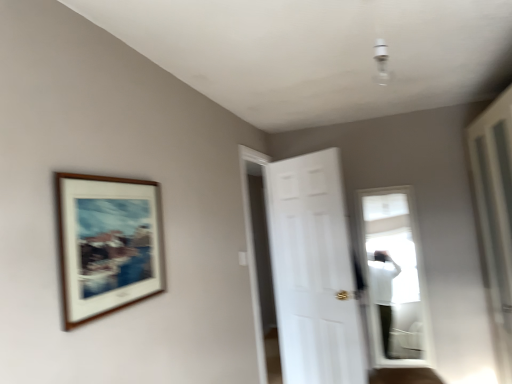
Question: Would you say wooden frame at upper left is to the left or to the right of white matte door at center in the picture?

Choices:
 (A) left
 (B) right

Answer: (A)

Question: Looking at the image, does wooden frame at upper left seem bigger or smaller compared to white matte door at center?

Choices:
 (A) big
 (B) small

Answer: (B)

Question: Looking at their shapes, would you say wooden frame at upper left is wider or thinner than white matte door at center?

Choices:
 (A) wide
 (B) thin

Answer: (B)

Question: From the image's perspective, relative to wooden frame at upper left, is white matte door at center above or below?

Choices:
 (A) above
 (B) below

Answer: (B)

Question: Relative to wooden frame at upper left, is white matte door at center in front or behind?

Choices:
 (A) front
 (B) behind

Answer: (B)

Question: Looking at their shapes, would you say white matte door at center is wider or thinner than wooden frame at upper left?

Choices:
 (A) wide
 (B) thin

Answer: (A)

Question: In the image, is white matte door at center on the left side or the right side of wooden frame at upper left?

Choices:
 (A) left
 (B) right

Answer: (B)